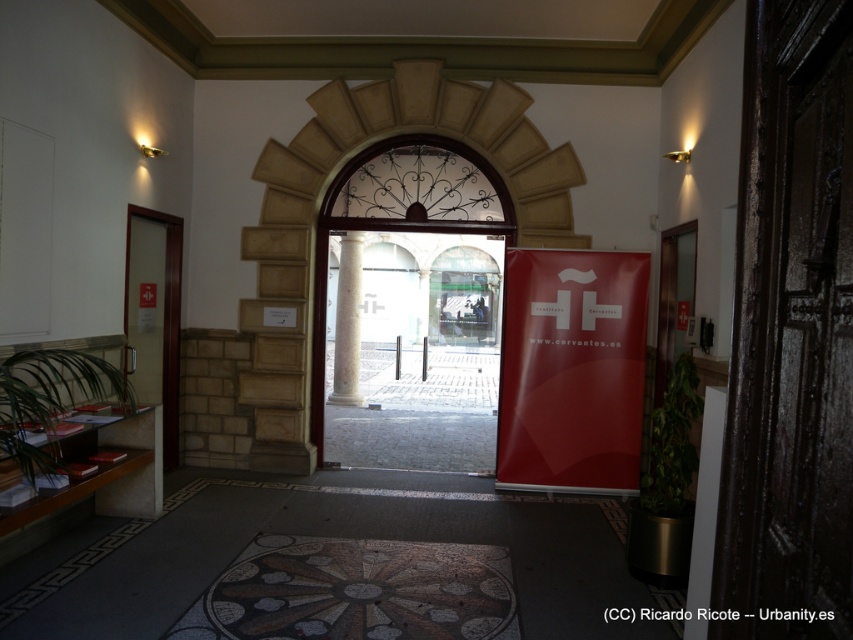
Who is lower down, transparent glass door at left or white glossy pillar at right?

white glossy pillar at right is below.

Can you confirm if transparent glass door at left is positioned to the right of white glossy pillar at right?

No, transparent glass door at left is not to the right of white glossy pillar at right.

This screenshot has height=640, width=853. What do you see at coordinates (155, 314) in the screenshot? I see `transparent glass door at left` at bounding box center [155, 314].

Where is `transparent glass door at left`? The height and width of the screenshot is (640, 853). transparent glass door at left is located at coordinates (155, 314).

Looking at this image, can you confirm if dark wood door at right is wider than transparent glass door at center?

In fact, dark wood door at right might be narrower than transparent glass door at center.

Locate an element on the screen. dark wood door at right is located at coordinates (790, 333).

In order to click on dark wood door at right in this screenshot , I will do `click(790, 333)`.

Is transparent glass door at center smaller than white marble column at center?

Actually, transparent glass door at center might be larger than white marble column at center.

Which is above, transparent glass door at center or white marble column at center?

transparent glass door at center

Locate an element on the screen. This screenshot has width=853, height=640. transparent glass door at center is located at coordinates (412, 349).